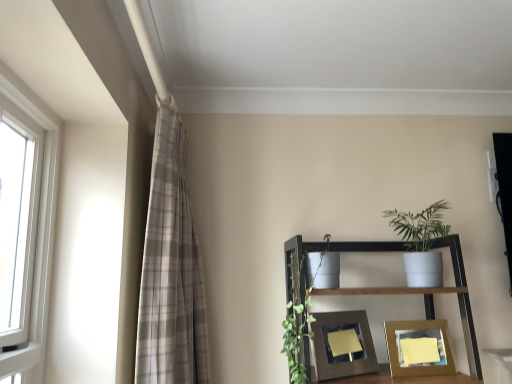
Question: Should I look upward or downward to see matte brown picture frame at center, which appears as the second picture frame when viewed from the right?

Choices:
 (A) down
 (B) up

Answer: (A)

Question: Is matte brown picture frame at center, the 1th picture frame from the left, with white plastic window at left?

Choices:
 (A) yes
 (B) no

Answer: (B)

Question: Is white plastic window at left completely or partially inside matte brown picture frame at center, the 1th picture frame from the left?

Choices:
 (A) no
 (B) yes

Answer: (A)

Question: Is matte brown picture frame at center, the 1th picture frame from the left, facing away from white plastic window at left?

Choices:
 (A) no
 (B) yes

Answer: (A)

Question: From a real-world perspective, is matte brown picture frame at center, the 1th picture frame from the left, over white plastic window at left?

Choices:
 (A) yes
 (B) no

Answer: (B)

Question: Can you confirm if matte brown picture frame at center, the 1th picture frame from the left, is bigger than white plastic window at left?

Choices:
 (A) no
 (B) yes

Answer: (A)

Question: Is matte brown picture frame at center, which appears as the second picture frame when viewed from the right, taller than white plastic window at left?

Choices:
 (A) no
 (B) yes

Answer: (A)

Question: Is wooden picture frame at lower center, the 1th picture frame from the right, shorter than plaid fabric curtain at left?

Choices:
 (A) yes
 (B) no

Answer: (A)

Question: Does wooden picture frame at lower center, which is the 2th picture frame from left to right, have a larger size compared to plaid fabric curtain at left?

Choices:
 (A) yes
 (B) no

Answer: (B)

Question: Is wooden picture frame at lower center, which is the 2th picture frame from left to right, with plaid fabric curtain at left?

Choices:
 (A) no
 (B) yes

Answer: (A)

Question: From a real-world perspective, does wooden picture frame at lower center, which is the 2th picture frame from left to right, stand above plaid fabric curtain at left?

Choices:
 (A) yes
 (B) no

Answer: (B)

Question: Does wooden picture frame at lower center, which is the 2th picture frame from left to right, lie in front of plaid fabric curtain at left?

Choices:
 (A) no
 (B) yes

Answer: (A)

Question: Is plaid fabric curtain at left at the back of wooden picture frame at lower center, the 1th picture frame from the right?

Choices:
 (A) yes
 (B) no

Answer: (B)

Question: Considering the relative sizes of matte brown picture frame at center, which appears as the second picture frame when viewed from the right, and wooden picture frame at lower center, which is the 2th picture frame from left to right, in the image provided, is matte brown picture frame at center, which appears as the second picture frame when viewed from the right, wider than wooden picture frame at lower center, which is the 2th picture frame from left to right,?

Choices:
 (A) yes
 (B) no

Answer: (B)